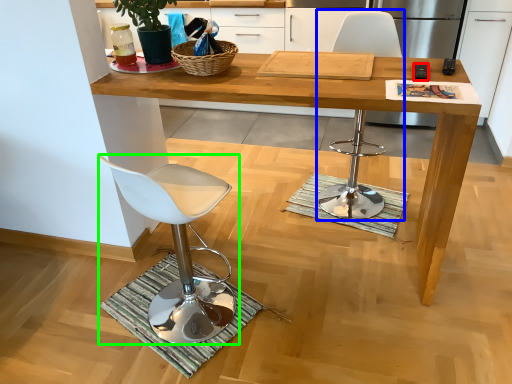
Question: Considering the real-world distances, which object is closest to remote control (highlighted by a red box)? chair (highlighted by a blue box) or chair (highlighted by a green box).

Choices:
 (A) chair
 (B) chair

Answer: (A)